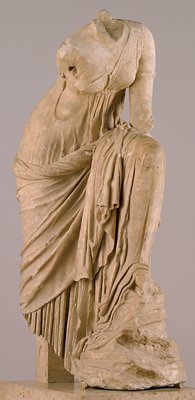
I want to click on background wall, so click(177, 243).